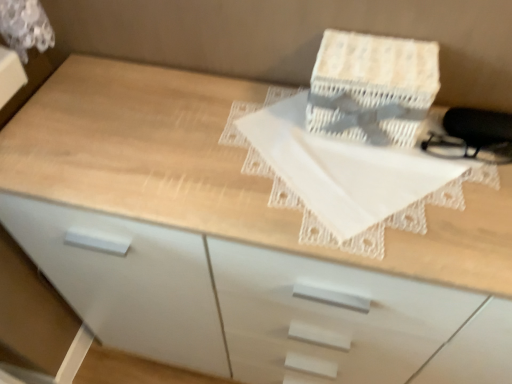
Find the location of `vacant area situated below white lace cloth at center (from a real-world perspective)`. vacant area situated below white lace cloth at center (from a real-world perspective) is located at coordinates (335, 178).